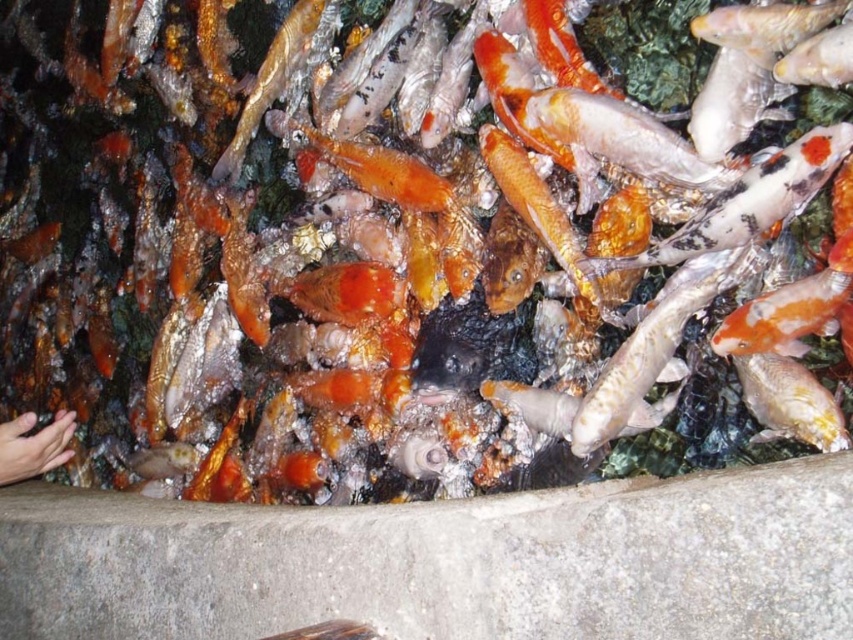
You are a fisherman who wants to catch the shiny gold fish at upper left. You have a fishing rod that can reach 60 centimeters. There is a smooth skin hand at lower left that might interfere. Can you safely catch the fish without the hand getting in the way?

The shiny gold fish at upper left and smooth skin hand at lower left are 59.92 centimeters apart. Since the fishing rod can reach 60 centimeters, it is just enough to reach the fish while keeping the hand at lower left out of the way.

Consider the image. You are a child who wants to catch the shiny silver fish at center with your hand. Based on the scene, can you reach the fish with your smooth skin hand at lower left?

The shiny silver fish at center has a lesser height compared to smooth skin hand at lower left, so yes, the child can reach the fish with their smooth skin hand at lower left since the hand is taller than the fish.